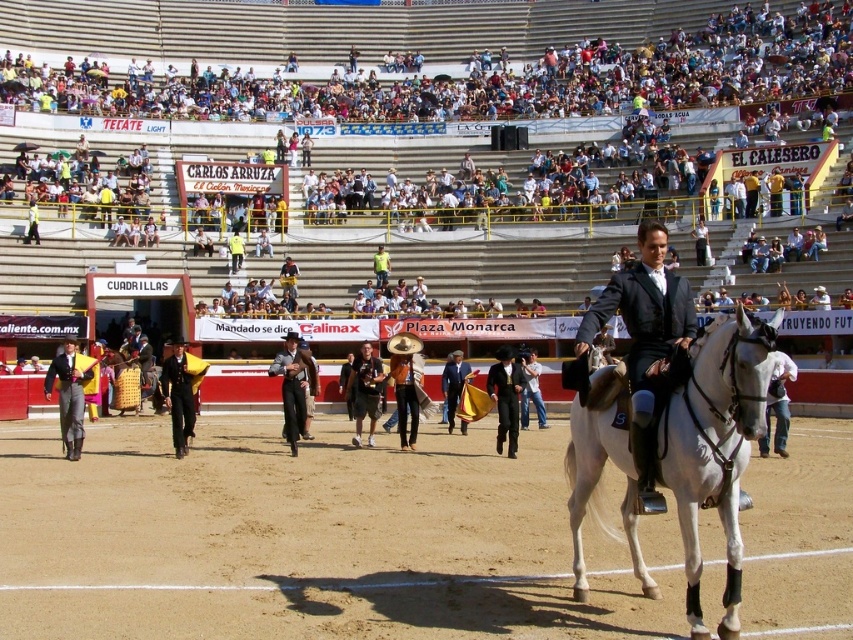
Question: Does white glossy horse at center have a smaller size compared to black satin suit at center?

Choices:
 (A) yes
 (B) no

Answer: (A)

Question: Which point appears closest to the camera in this image?

Choices:
 (A) (515, 403)
 (B) (556, 138)
 (C) (651, 333)

Answer: (C)

Question: Can you confirm if brown sandy dirt track at center is wider than white glossy horse at center?

Choices:
 (A) no
 (B) yes

Answer: (B)

Question: Is black satin suit at center positioned at the back of dark blue jeans at center?

Choices:
 (A) no
 (B) yes

Answer: (A)

Question: Which object appears farthest from the camera in this image?

Choices:
 (A) brown sandy dirt track at center
 (B) black leather suit at center
 (C) white cotton shirt at upper center
 (D) black satin suit at center

Answer: (C)

Question: Among these objects, which one is nearest to the camera?

Choices:
 (A) black leather suit at center
 (B) white cotton shirt at upper center
 (C) white glossy horse at center

Answer: (C)